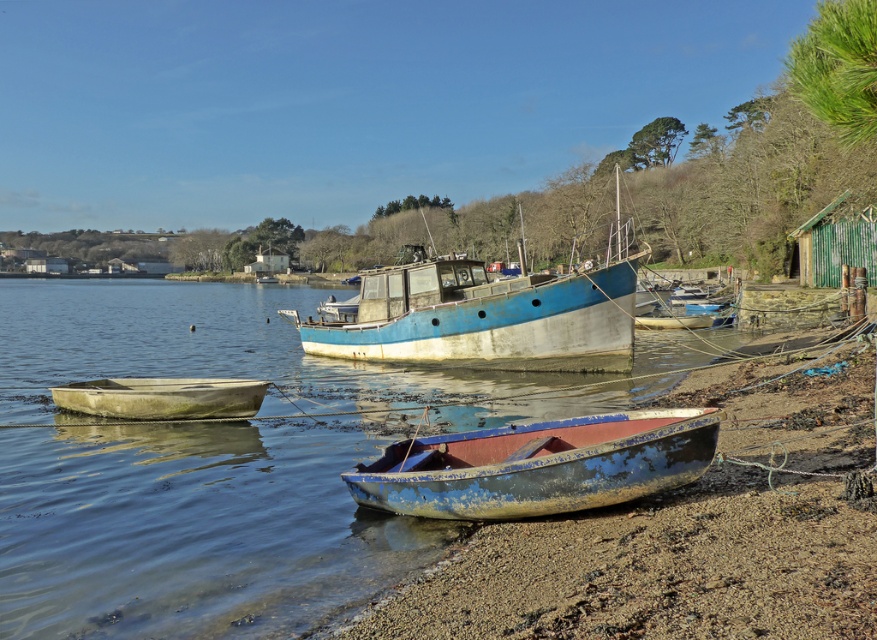
You are a maintenance worker needing to move a 20 feet long equipment between the blue weathered canoe at lower center and the white weathered canoe at lower left. Can you fit the equipment between them without moving either canoe?

The blue weathered canoe at lower center and white weathered canoe at lower left are 21.16 feet apart from each other. Since the equipment is 20 feet long, it can fit between them as the distance is sufficient.